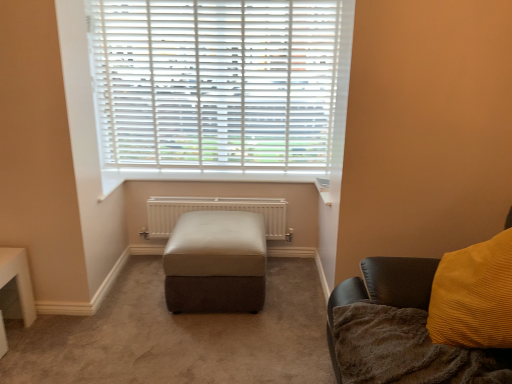
From the picture: What is the approximate width of white plastic blinds at upper center?

It is 3.00 inches.

The height and width of the screenshot is (384, 512). Identify the location of leather ottoman at center. (216, 263).

What do you see at coordinates (214, 210) in the screenshot?
I see `white metallic radiator at center` at bounding box center [214, 210].

In order to face brown fuzzy blanket at lower right, should I rotate leftwards or rightwards?

Turn right approximately 21.094 degrees to face it.

Find the location of a particular element. white plastic blinds at upper center is located at coordinates (220, 88).

Consider the image. Can you confirm if velvet mustard pillow at right is wider than leather ottoman at center?

Indeed, velvet mustard pillow at right has a greater width compared to leather ottoman at center.

From a real-world perspective, who is located lower, velvet mustard pillow at right or leather ottoman at center?

leather ottoman at center, from a real-world perspective.

Considering the positions of points (344, 293) and (185, 218), is point (344, 293) farther from camera compared to point (185, 218)?

No, (344, 293) is in front of (185, 218).

Can you confirm if white metallic radiator at center is positioned to the right of brown fuzzy blanket at lower right?

No.

From the image's perspective, which is below, white metallic radiator at center or brown fuzzy blanket at lower right?

brown fuzzy blanket at lower right appears lower in the image.

From a real-world perspective, is white metallic radiator at center physically above brown fuzzy blanket at lower right?

No, from a real-world perspective, white metallic radiator at center is not on top of brown fuzzy blanket at lower right.

From the image's perspective, which object appears higher, leather ottoman at center or white plastic blinds at upper center?

white plastic blinds at upper center is shown above in the image.

Is leather ottoman at center oriented towards white plastic blinds at upper center?

No, leather ottoman at center is not aimed at white plastic blinds at upper center.

Is leather ottoman at center positioned far away from white plastic blinds at upper center?

No, leather ottoman at center is in close proximity to white plastic blinds at upper center.

Is leather ottoman at center taller than white plastic blinds at upper center?

Incorrect, the height of leather ottoman at center is not larger of that of white plastic blinds at upper center.

Is brown fuzzy blanket at lower right aimed at white plastic blinds at upper center?

No, brown fuzzy blanket at lower right is not oriented towards white plastic blinds at upper center.

In the scene shown: From the image's perspective, relative to white plastic blinds at upper center, is brown fuzzy blanket at lower right above or below?

Based on their image positions, brown fuzzy blanket at lower right is located beneath white plastic blinds at upper center.

Is brown fuzzy blanket at lower right positioned beyond the bounds of white plastic blinds at upper center?

Yes.

Which object is wider, brown fuzzy blanket at lower right or white plastic blinds at upper center?

brown fuzzy blanket at lower right.

What's the angular difference between leather ottoman at center and velvet mustard pillow at right's facing directions?

They differ by 91 degrees in their facing directions.

From the image's perspective, is leather ottoman at center located above velvet mustard pillow at right?

Yes, from the image's perspective, leather ottoman at center is on top of velvet mustard pillow at right.

Considering the sizes of objects leather ottoman at center and velvet mustard pillow at right in the image provided, who is shorter, leather ottoman at center or velvet mustard pillow at right?

With less height is leather ottoman at center.

From a real-world perspective, is leather ottoman at center physically above velvet mustard pillow at right?

No, from a real-world perspective, leather ottoman at center is not over velvet mustard pillow at right

From the image's perspective, is velvet mustard pillow at right positioned above or below brown fuzzy blanket at lower right?

velvet mustard pillow at right is above brown fuzzy blanket at lower right.

Considering the sizes of objects velvet mustard pillow at right and brown fuzzy blanket at lower right in the image provided, who is bigger, velvet mustard pillow at right or brown fuzzy blanket at lower right?

velvet mustard pillow at right is bigger.

Is there a large distance between velvet mustard pillow at right and white metallic radiator at center?

Yes, velvet mustard pillow at right is far from white metallic radiator at center.

The width and height of the screenshot is (512, 384). I want to click on studio couch that appears above the white metallic radiator at center (from a real-world perspective), so click(x=340, y=305).

Is velvet mustard pillow at right oriented towards white metallic radiator at center?

No, velvet mustard pillow at right is not facing towards white metallic radiator at center.

Which is closer to the camera, (333, 354) or (189, 201)?

The point (333, 354) is closer to the camera.

In the image, there is a velvet mustard pillow at right. Where is `furniture above it (from the image's perspective)`? Image resolution: width=512 pixels, height=384 pixels. furniture above it (from the image's perspective) is located at coordinates (216, 263).

Where is `radiator lying on the left of brown fuzzy blanket at lower right`? Image resolution: width=512 pixels, height=384 pixels. radiator lying on the left of brown fuzzy blanket at lower right is located at coordinates (214, 210).

Looking at the image, which one is located closer to brown fuzzy blanket at lower right, velvet mustard pillow at right or white plastic blinds at upper center?

The object closer to brown fuzzy blanket at lower right is velvet mustard pillow at right.

Estimate the real-world distances between objects in this image. Which object is further from velvet mustard pillow at right, white plastic blinds at upper center or leather ottoman at center?

white plastic blinds at upper center lies further to velvet mustard pillow at right than the other object.

Estimate the real-world distances between objects in this image. Which object is further from white metallic radiator at center, brown fuzzy blanket at lower right or white plastic blinds at upper center?

brown fuzzy blanket at lower right.

From the image, which object appears to be farther from white metallic radiator at center, velvet mustard pillow at right or white plastic blinds at upper center?

velvet mustard pillow at right is positioned further to the anchor white metallic radiator at center.

Estimate the real-world distances between objects in this image. Which object is closer to leather ottoman at center, white metallic radiator at center or brown fuzzy blanket at lower right?

Based on the image, white metallic radiator at center appears to be nearer to leather ottoman at center.

Looking at this image, from the image, which object appears to be nearer to leather ottoman at center, brown fuzzy blanket at lower right or white plastic blinds at upper center?

Based on the image, white plastic blinds at upper center appears to be nearer to leather ottoman at center.

Which object lies further to the anchor point white metallic radiator at center, brown fuzzy blanket at lower right or velvet mustard pillow at right?

brown fuzzy blanket at lower right is further to white metallic radiator at center.

Estimate the real-world distances between objects in this image. Which object is closer to brown fuzzy blanket at lower right, white metallic radiator at center or velvet mustard pillow at right?

velvet mustard pillow at right.

Locate an element on the screen. blanket between velvet mustard pillow at right and white plastic blinds at upper center from front to back is located at coordinates (407, 350).

The width and height of the screenshot is (512, 384). In order to click on furniture between velvet mustard pillow at right and white metallic radiator at center from front to back in this screenshot , I will do `click(216, 263)`.

This screenshot has height=384, width=512. I want to click on window blind between brown fuzzy blanket at lower right and white metallic radiator at center along the z-axis, so [220, 88].

Where is `radiator between white plastic blinds at upper center and leather ottoman at center from top to bottom`? This screenshot has height=384, width=512. radiator between white plastic blinds at upper center and leather ottoman at center from top to bottom is located at coordinates (214, 210).